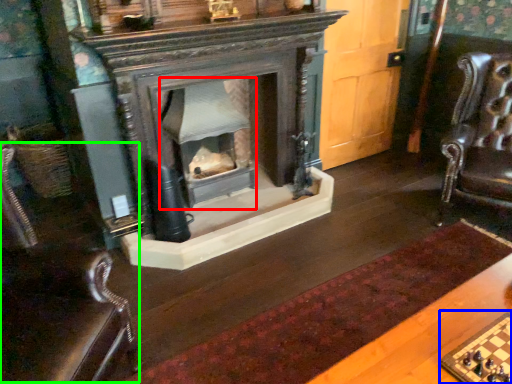
Question: Which object is positioned farthest from fireplace (highlighted by a red box)? Select from board game (highlighted by a blue box) and rocking chair (highlighted by a green box).

Choices:
 (A) board game
 (B) rocking chair

Answer: (A)